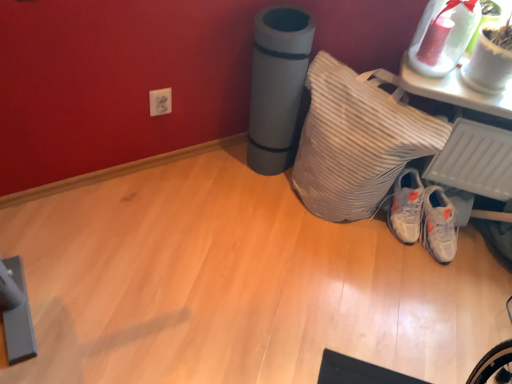
Describe the element at coordinates (454, 91) in the screenshot. This screenshot has height=384, width=512. I see `white glossy vase at upper right` at that location.

You are a GUI agent. You are given a task and a screenshot of the screen. Output one action in this format:
    pyautogui.click(x=<x>, y=<y>)
    Task: Click on the white matte sneakers at lower right
    The width and height of the screenshot is (512, 384).
    Given the screenshot: What is the action you would take?
    pyautogui.click(x=423, y=217)

Considering the points (408, 212) and (454, 97), which point is in front, point (408, 212) or point (454, 97)?

The point (454, 97) is in front.

From the image's perspective, relative to white glossy vase at upper right, is white matte sneakers at lower right above or below?

Based on their image positions, white matte sneakers at lower right is located beneath white glossy vase at upper right.

Is white matte sneakers at lower right not near white glossy vase at upper right?

Actually, white matte sneakers at lower right and white glossy vase at upper right are a little close together.

Considering the relative positions of white matte sneakers at lower right and white striped pillow at lower right in the image provided, is white matte sneakers at lower right to the left of white striped pillow at lower right from the viewer's perspective?

No, white matte sneakers at lower right is not to the left of white striped pillow at lower right.

Does point (450, 203) come in front of point (328, 62)?

No, (450, 203) is behind (328, 62).

Is white matte sneakers at lower right shorter than white striped pillow at lower right?

Indeed, white matte sneakers at lower right has a lesser height compared to white striped pillow at lower right.

Who is bigger, white matte sneakers at lower right or white striped pillow at lower right?

white striped pillow at lower right is bigger.

In the scene shown: Which of these two, white glossy vase at upper right or white striped pillow at lower right, is thinner?

Thinner between the two is white glossy vase at upper right.

Could you tell me if white glossy vase at upper right is facing white striped pillow at lower right?

No, white glossy vase at upper right is not turned towards white striped pillow at lower right.

Is white glossy vase at upper right closer to the viewer compared to white striped pillow at lower right?

No.

Are white glossy vase at upper right and white striped pillow at lower right beside each other?

white glossy vase at upper right and white striped pillow at lower right are not in contact.

Considering the positions of objects white striped pillow at lower right and white matte sneakers at lower right in the image provided, who is more to the left, white striped pillow at lower right or white matte sneakers at lower right?

white striped pillow at lower right is more to the left.

Locate an element on the screen. The height and width of the screenshot is (384, 512). pillow above the white matte sneakers at lower right (from the image's perspective) is located at coordinates (356, 141).

Could you tell me if white striped pillow at lower right is facing white matte sneakers at lower right?

No, white striped pillow at lower right is not turned towards white matte sneakers at lower right.

From a real-world perspective, is white striped pillow at lower right above or below white matte sneakers at lower right?

In terms of real-world spatial position, white striped pillow at lower right is above white matte sneakers at lower right.

Considering the sizes of objects white striped pillow at lower right and white glossy vase at upper right in the image provided, who is taller, white striped pillow at lower right or white glossy vase at upper right?

With more height is white striped pillow at lower right.

What's the angular difference between white striped pillow at lower right and white glossy vase at upper right's facing directions?

1.47 degrees separate the facing orientations of white striped pillow at lower right and white glossy vase at upper right.

Locate an element on the screen. furniture lying on the right of white striped pillow at lower right is located at coordinates (454, 91).

Looking at their sizes, would you say white glossy vase at upper right is wider or thinner than white matte sneakers at lower right?

Considering their sizes, white glossy vase at upper right looks broader than white matte sneakers at lower right.

Is white glossy vase at upper right completely or partially outside of white matte sneakers at lower right?

Yes, white glossy vase at upper right is not within white matte sneakers at lower right.

In the image, is white glossy vase at upper right on the left side or the right side of white matte sneakers at lower right?

Clearly, white glossy vase at upper right is on the right of white matte sneakers at lower right in the image.

Would you say white glossy vase at upper right is a long distance from white matte sneakers at lower right?

No, white glossy vase at upper right is not far away from white matte sneakers at lower right.

The height and width of the screenshot is (384, 512). I want to click on footwear below the white glossy vase at upper right (from the image's perspective), so click(423, 217).

Locate an element on the screen. This screenshot has width=512, height=384. footwear behind the white striped pillow at lower right is located at coordinates (423, 217).

Based on their spatial positions, is white striped pillow at lower right or white matte sneakers at lower right closer to white glossy vase at upper right?

The object closer to white glossy vase at upper right is white striped pillow at lower right.

From the picture: Looking at the image, which one is located further to white striped pillow at lower right, white matte sneakers at lower right or white glossy vase at upper right?

white matte sneakers at lower right lies further to white striped pillow at lower right than the other object.

Which object lies nearer to the anchor point white matte sneakers at lower right, white glossy vase at upper right or white striped pillow at lower right?

white striped pillow at lower right.

Based on their spatial positions, is white glossy vase at upper right or white matte sneakers at lower right closer to white striped pillow at lower right?

white glossy vase at upper right is closer to white striped pillow at lower right.

Based on their spatial positions, is white matte sneakers at lower right or white striped pillow at lower right closer to white glossy vase at upper right?

Among the two, white striped pillow at lower right is located nearer to white glossy vase at upper right.

From the image, which object appears to be farther from white matte sneakers at lower right, white striped pillow at lower right or white glossy vase at upper right?

white glossy vase at upper right.

The image size is (512, 384). I want to click on pillow between white glossy vase at upper right and white matte sneakers at lower right from top to bottom, so click(x=356, y=141).